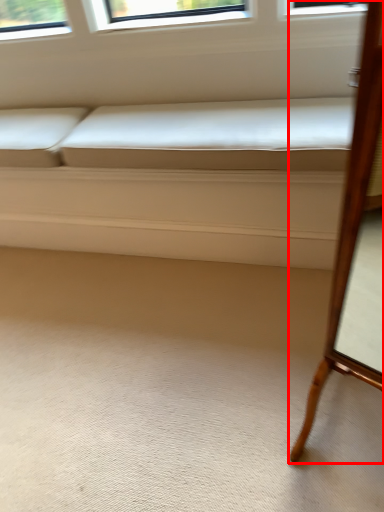
Question: Considering the relative positions of furniture (annotated by the red box) and couch in the image provided, where is furniture (annotated by the red box) located with respect to the staircase?

Choices:
 (A) left
 (B) right

Answer: (B)